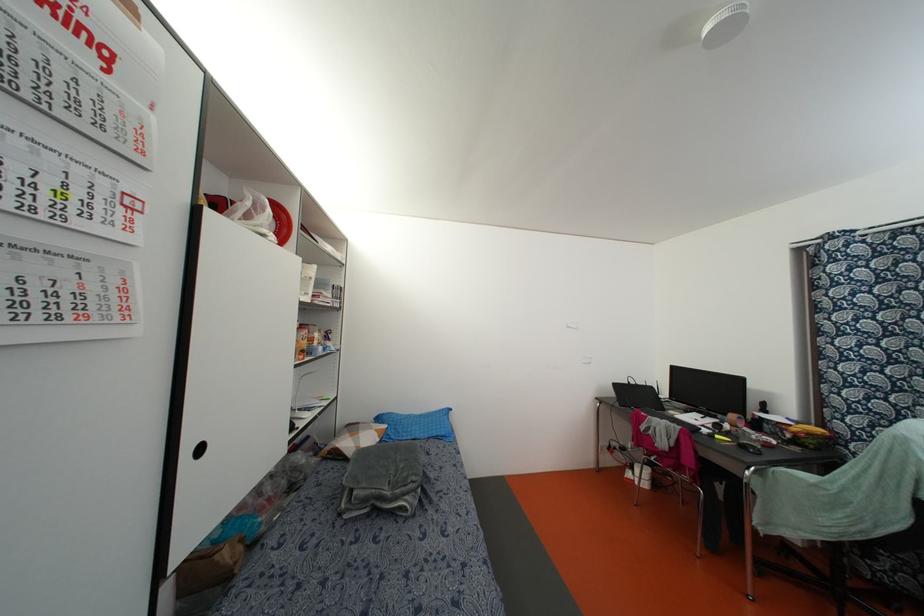
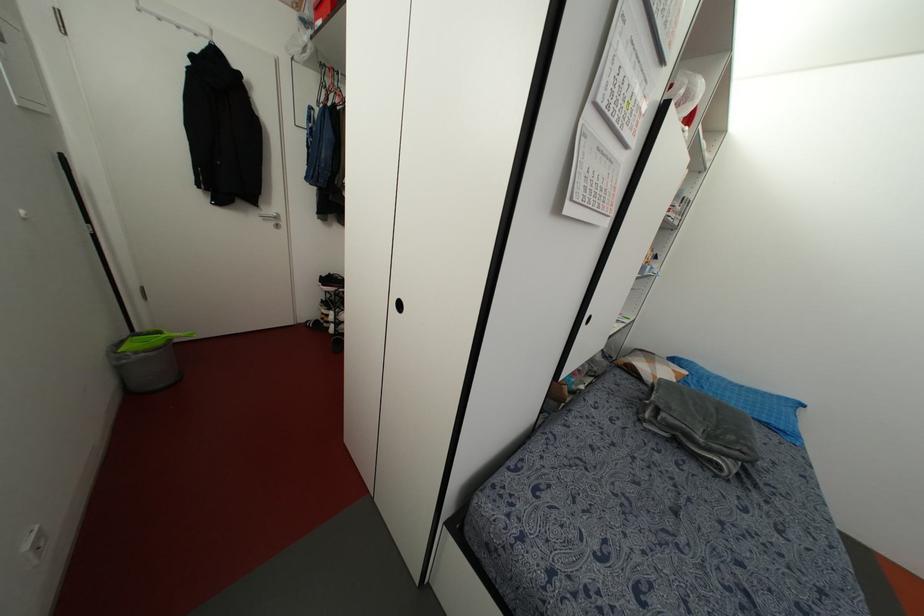
Where in the second image is the point corresponding to (x=354, y=493) from the first image?

(663, 415)